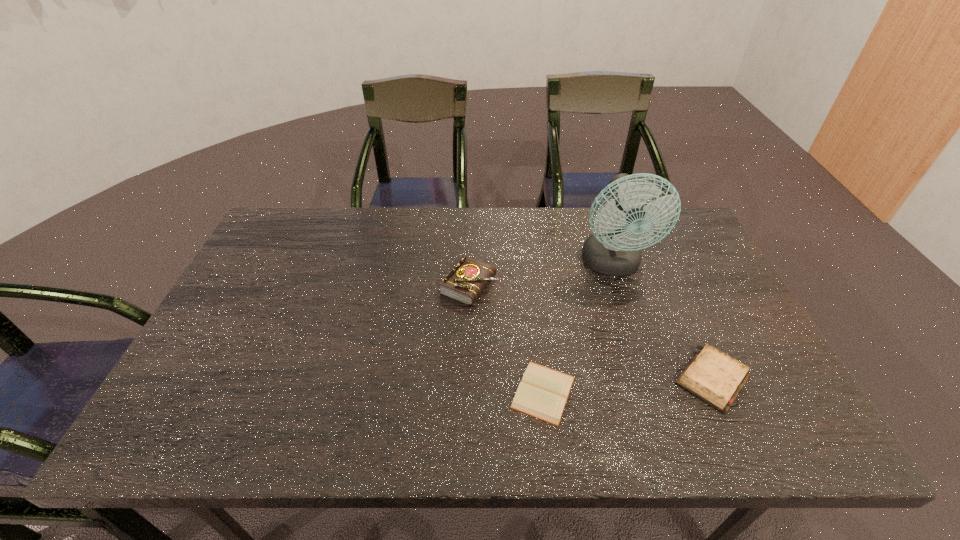
The height and width of the screenshot is (540, 960). In order to click on vacant space situated 0.350m on the back of the shortest diary in this screenshot , I will do `click(528, 266)`.

You are a GUI agent. You are given a task and a screenshot of the screen. Output one action in this format:
    pyautogui.click(x=<x>, y=<y>)
    Task: Click on the object located at the far edge
    The image size is (960, 540).
    Given the screenshot: What is the action you would take?
    pyautogui.click(x=613, y=249)

Identify the location of object located in the right edge section of the desktop. (714, 377).

Identify the location of object at the near right corner. The height and width of the screenshot is (540, 960). (714, 377).

The image size is (960, 540). Identify the location of blank space at the far edge of the desktop. (437, 211).

Identify the location of vacant space at the near edge. [x=468, y=409].

Where is `free location at the left edge of the desktop`? Image resolution: width=960 pixels, height=540 pixels. free location at the left edge of the desktop is located at coordinates (293, 267).

Image resolution: width=960 pixels, height=540 pixels. I want to click on vacant space at the right edge of the desktop, so click(730, 344).

Locate an element on the screen. The height and width of the screenshot is (540, 960). free point at the near left corner is located at coordinates pyautogui.click(x=218, y=416).

The image size is (960, 540). In the image, there is a desktop. What are the coordinates of `vacant space at the far right corner` in the screenshot? It's located at (654, 226).